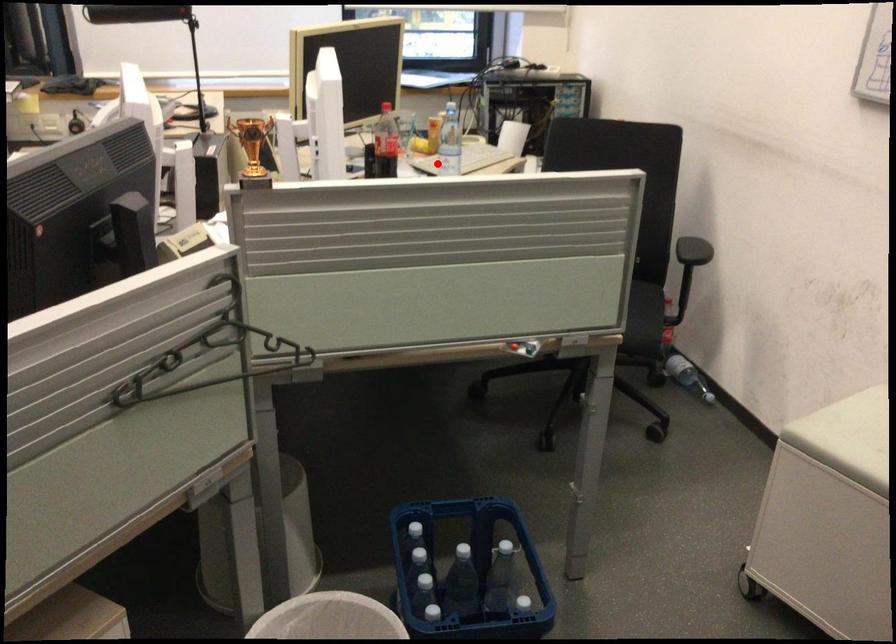
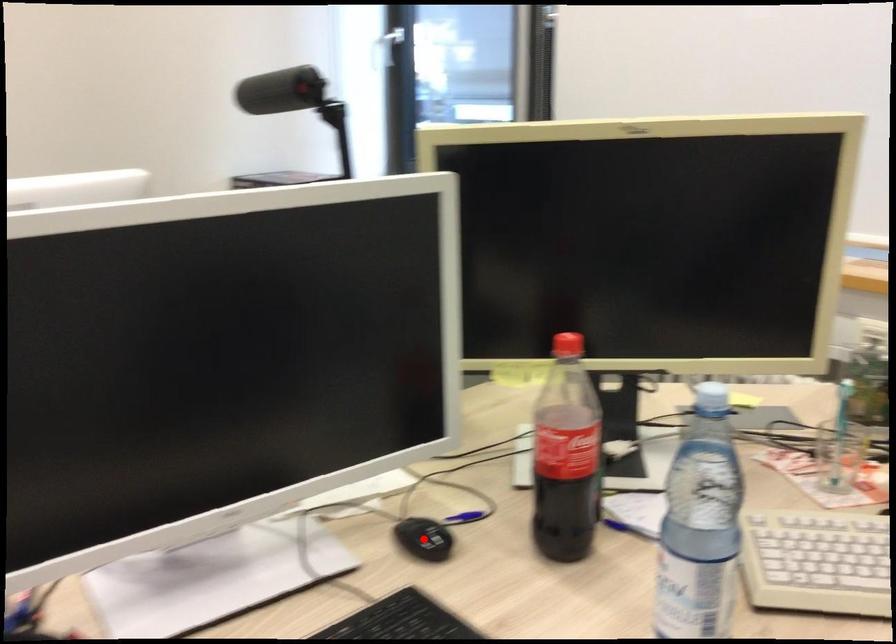
I am providing you with two images of the same scene from different viewpoints. A red point is marked on the first image and another point is marked on the second image. Does the point marked in image1 correspond to the same location as the one in image2?

No